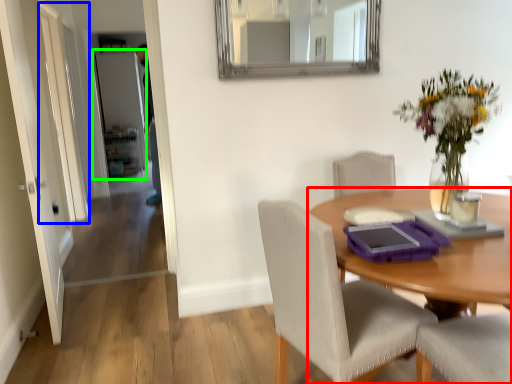
Question: Which is farther away from desk (highlighted by a red box)? glass door (highlighted by a blue box) or door (highlighted by a green box)?

Choices:
 (A) glass door
 (B) door

Answer: (B)